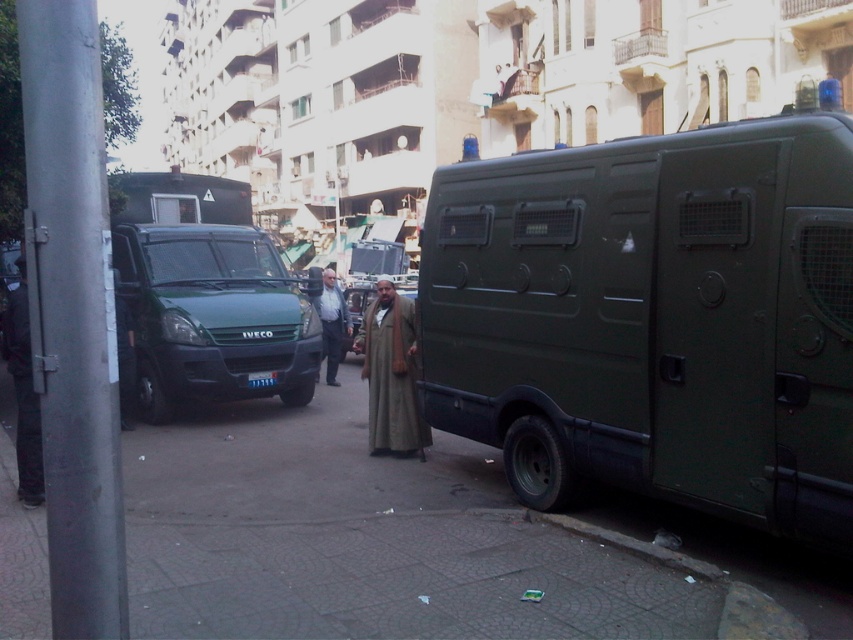
Question: Estimate the real-world distances between objects in this image. Which object is closer to the matte green van at right?

Choices:
 (A) black leather pants at left
 (B) beige woolen robe at center

Answer: (B)

Question: Which object appears closest to the camera in this image?

Choices:
 (A) beige woolen robe at center
 (B) green matte van at center

Answer: (A)

Question: From the image, what is the correct spatial relationship of matte green van at right in relation to beige woolen robe at center?

Choices:
 (A) below
 (B) above

Answer: (B)

Question: Among these points, which one is farthest from the camera?

Choices:
 (A) (387, 372)
 (B) (155, 289)

Answer: (B)

Question: Can you confirm if matte green van at right is positioned above dark brown leather jacket at center?

Choices:
 (A) yes
 (B) no

Answer: (A)

Question: Can you confirm if matte green van at right is wider than black leather pants at left?

Choices:
 (A) no
 (B) yes

Answer: (B)